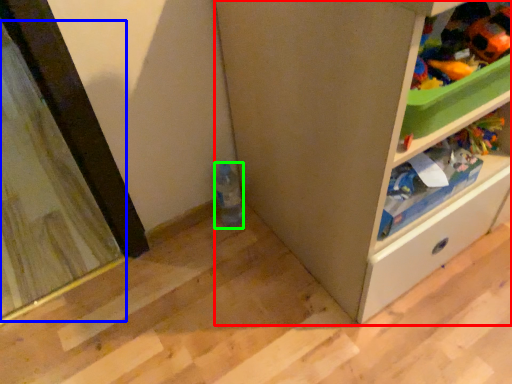
Question: Which is nearer to the cabinetry (highlighted by a red box)? screen door (highlighted by a blue box) or bottle (highlighted by a green box).

Choices:
 (A) screen door
 (B) bottle

Answer: (B)